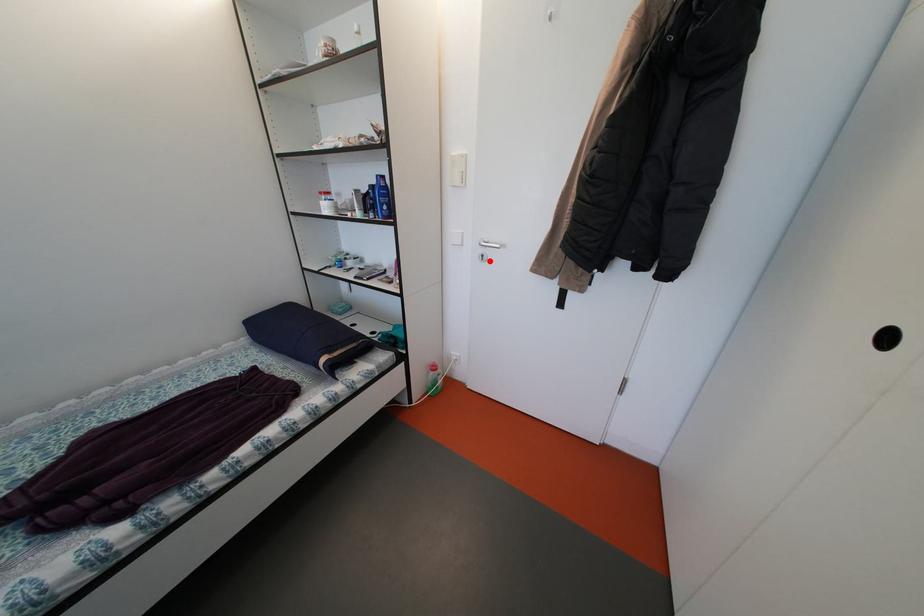
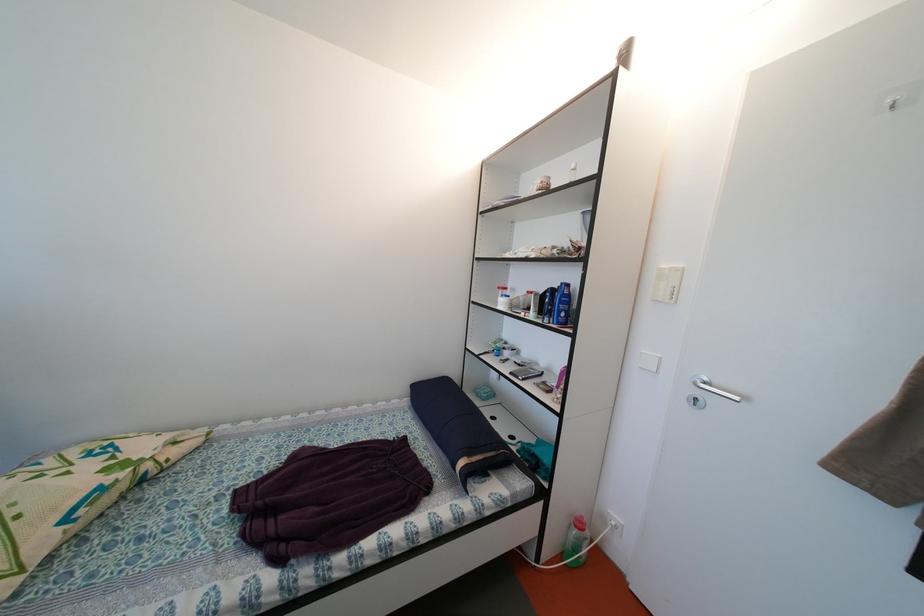
Where in the second image is the point corresponding to the highlighted location from the first image?

(703, 405)